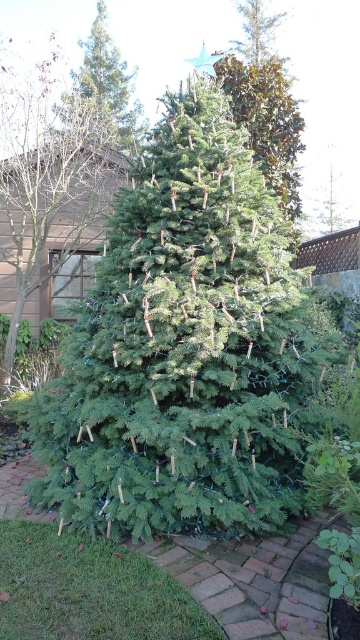
You are standing in the garden and want to place a new decoration on the green matte christmas tree at center. If your maximum reach is 7 feet, can you reach the tree without moving closer?

The green matte christmas tree at center is 9.49 feet away from the viewer, which is beyond your maximum reach of 7 feet. You will need to move closer to reach it.

You are standing in front of the Christmas tree and notice two points marked on the tree. The first point is at coordinates point (270, 182) and the second is at point (78, 195). Which of these points is closer to your viewpoint?

Point (270, 182) is closer to the camera than point (78, 195).

You are standing in the garden and see both the green matte christmas tree at center and the green matte tree at upper center. Which tree is located to the right when facing the image?

The green matte christmas tree at center is positioned on the right side of green matte tree at upper center, so it is located to the right when facing the image.